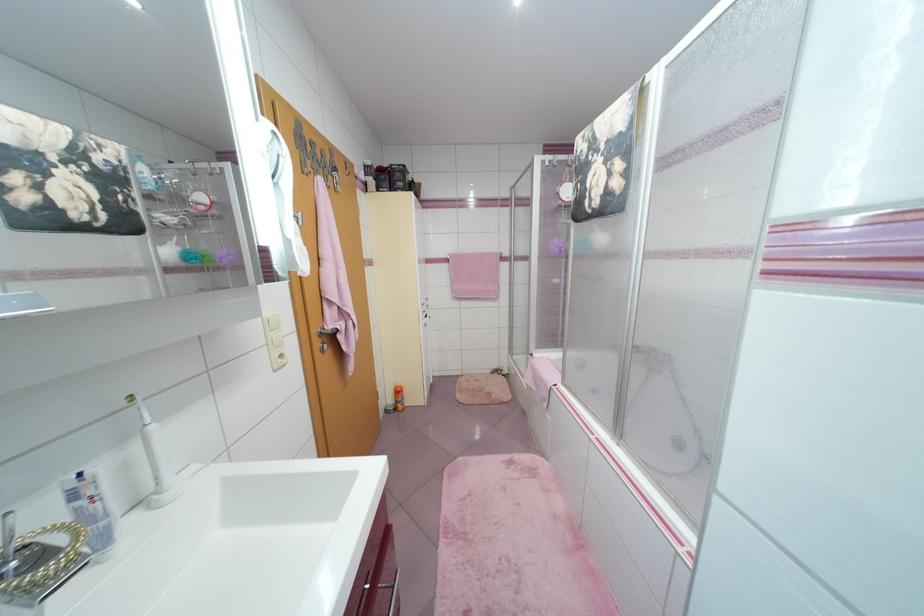
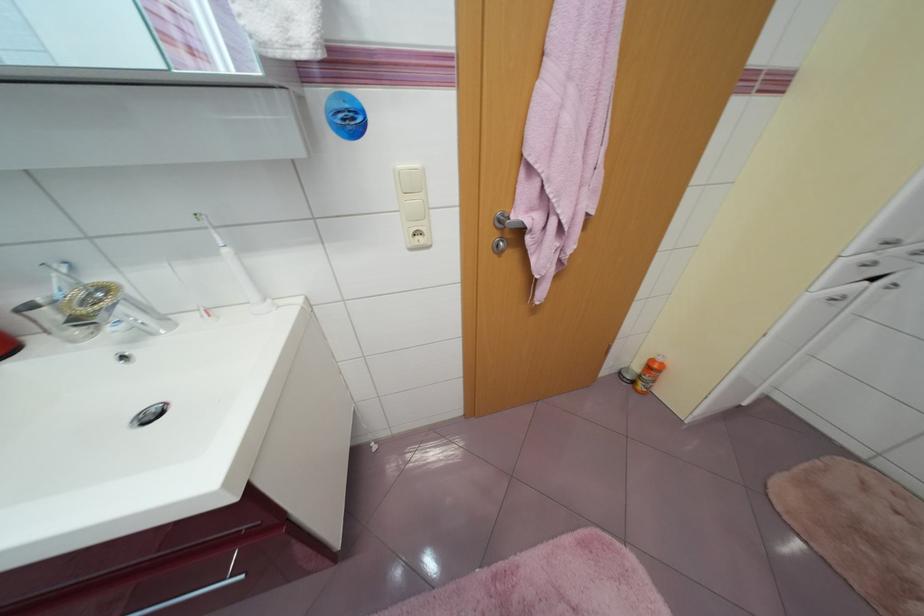
Where in the second image is the point corresponding to the point at 285,361 from the first image?

(423, 238)